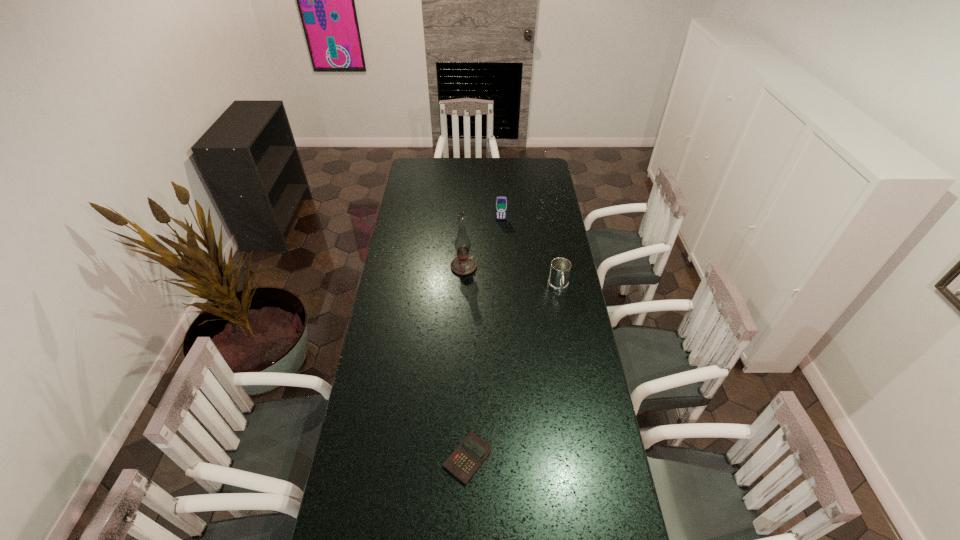
Find the location of a particular element. This screenshot has width=960, height=540. the tallest object is located at coordinates (463, 264).

This screenshot has height=540, width=960. I want to click on oil lamp, so click(x=463, y=264).

You are a GUI agent. You are given a task and a screenshot of the screen. Output one action in this format:
    pyautogui.click(x=<x>, y=<y>)
    Task: Click on the third object from left to right
    This screenshot has height=540, width=960.
    Given the screenshot: What is the action you would take?
    pyautogui.click(x=501, y=202)

The width and height of the screenshot is (960, 540). Identify the location of cellular telephone. (501, 202).

Where is `the rightmost object`? the rightmost object is located at coordinates coord(560,268).

Image resolution: width=960 pixels, height=540 pixels. What are the coordinates of `mug` in the screenshot? It's located at (560, 268).

You are a GUI agent. You are given a task and a screenshot of the screen. Output one action in this format:
    pyautogui.click(x=<x>, y=<y>)
    Task: Click on the nearest object
    This screenshot has height=540, width=960.
    Given the screenshot: What is the action you would take?
    pyautogui.click(x=470, y=454)

What are the coordinates of `the shortest object` in the screenshot? It's located at (470, 454).

Find the location of a particular element. This screenshot has width=960, height=540. vacant position located on the right of the tallest object is located at coordinates (511, 267).

The width and height of the screenshot is (960, 540). I want to click on vacant region located on the front-facing side of the third object from left to right, so click(502, 236).